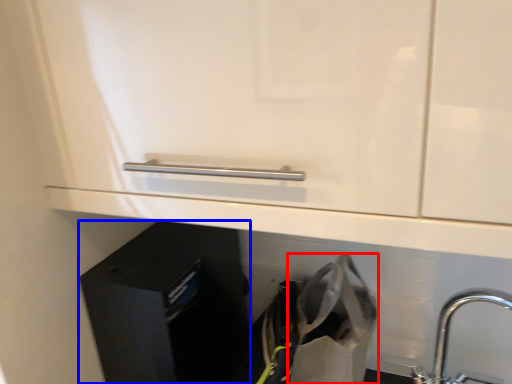
Question: Which object is closer to the camera taking this photo, shopping bag (highlighted by a red box) or file cabinet (highlighted by a blue box)?

Choices:
 (A) shopping bag
 (B) file cabinet

Answer: (A)